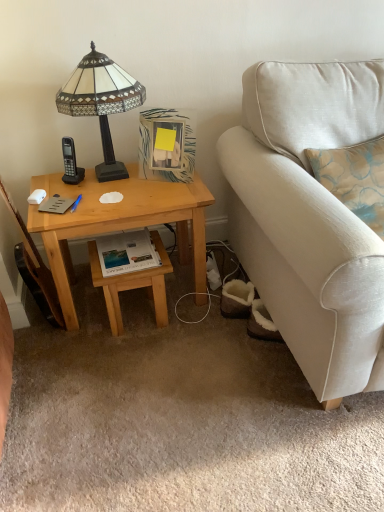
Question: Is light wood stool at lower center positioned in front of beige fabric couch at right?

Choices:
 (A) yes
 (B) no

Answer: (B)

Question: Is light wood stool at lower center beside beige fabric couch at right?

Choices:
 (A) yes
 (B) no

Answer: (B)

Question: Is light wood stool at lower center surrounding beige fabric couch at right?

Choices:
 (A) no
 (B) yes

Answer: (A)

Question: Is light wood stool at lower center looking in the opposite direction of beige fabric couch at right?

Choices:
 (A) no
 (B) yes

Answer: (A)

Question: Does light wood stool at lower center have a lesser height compared to beige fabric couch at right?

Choices:
 (A) yes
 (B) no

Answer: (A)

Question: Is light wood stool at lower center completely or partially outside of beige fabric couch at right?

Choices:
 (A) no
 (B) yes

Answer: (B)

Question: Can you confirm if light wood desk at left is smaller than beige fabric couch at right?

Choices:
 (A) no
 (B) yes

Answer: (B)

Question: Does light wood desk at left appear on the left side of beige fabric couch at right?

Choices:
 (A) no
 (B) yes

Answer: (B)

Question: Is light wood desk at left shorter than beige fabric couch at right?

Choices:
 (A) no
 (B) yes

Answer: (B)

Question: Is light wood desk at left wider than beige fabric couch at right?

Choices:
 (A) yes
 (B) no

Answer: (B)

Question: Considering the relative sizes of light wood desk at left and beige fabric couch at right in the image provided, is light wood desk at left taller than beige fabric couch at right?

Choices:
 (A) yes
 (B) no

Answer: (B)

Question: Does light wood desk at left lie in front of beige fabric couch at right?

Choices:
 (A) no
 (B) yes

Answer: (A)

Question: Considering the relative sizes of white glossy book at center and beige fabric couch at right in the image provided, is white glossy book at center smaller than beige fabric couch at right?

Choices:
 (A) no
 (B) yes

Answer: (B)